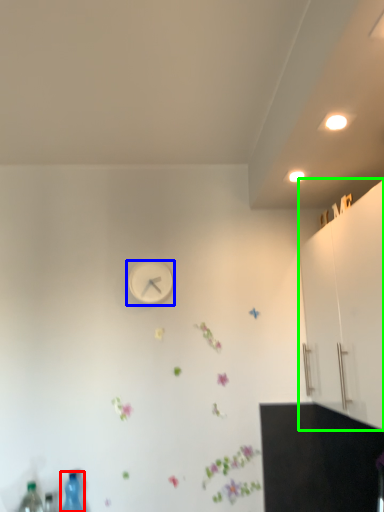
Question: Estimate the real-world distances between objects in this image. Which object is farther from bottle (highlighted by a red box), wall clock (highlighted by a blue box) or dresser (highlighted by a green box)?

Choices:
 (A) wall clock
 (B) dresser

Answer: (B)